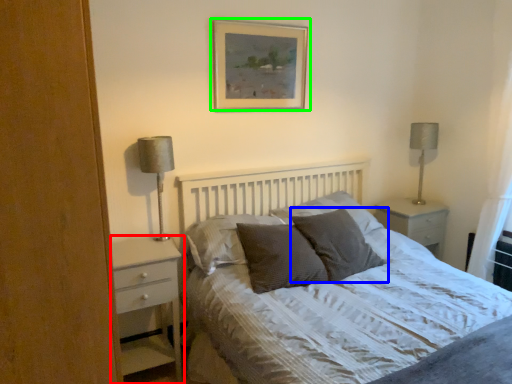
Question: Estimate the real-world distances between objects in this image. Which object is closer to chest of drawers (highlighted by a red box), pillow (highlighted by a blue box) or picture frame (highlighted by a green box)?

Choices:
 (A) pillow
 (B) picture frame

Answer: (A)